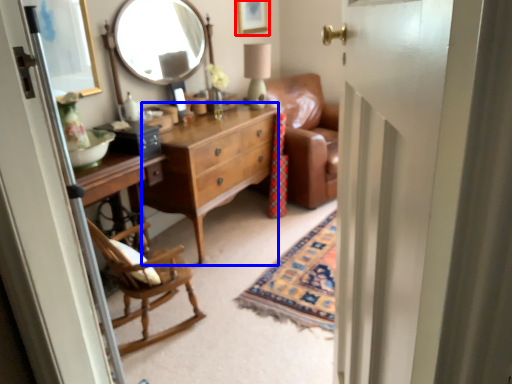
Question: Which object appears farthest to the camera in this image, picture frame (highlighted by a red box) or cabinetry (highlighted by a blue box)?

Choices:
 (A) picture frame
 (B) cabinetry

Answer: (A)